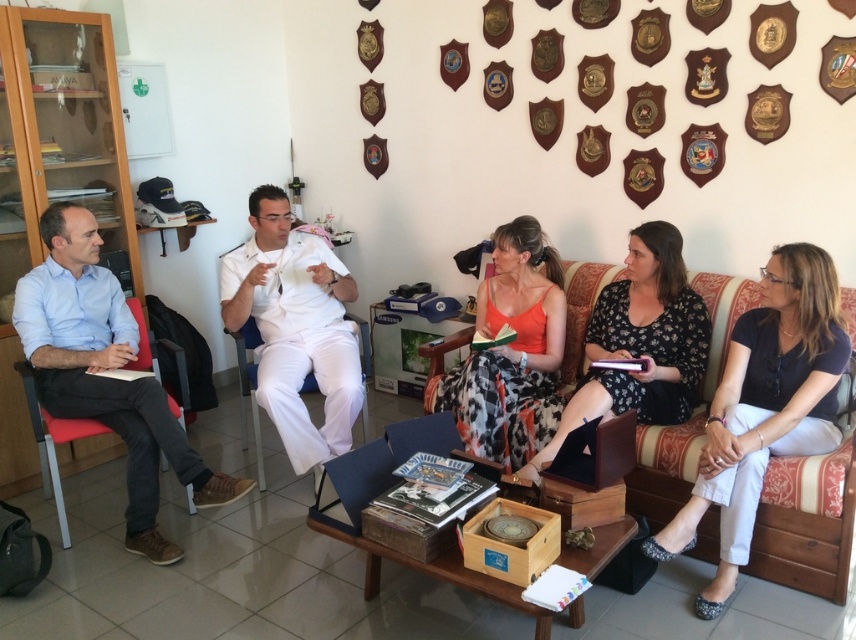
Does white matte uniform at center have a greater height compared to floral fabric dress at center?

Yes, white matte uniform at center is taller than floral fabric dress at center.

Does white matte uniform at center appear on the left side of floral fabric dress at center?

Indeed, white matte uniform at center is positioned on the left side of floral fabric dress at center.

Between point (313, 449) and point (667, 324), which one is positioned in front?

Point (667, 324) is in front.

Identify the location of white matte uniform at center. (295, 326).

Between white cotton pants at lower right and floral fabric dress at center, which one is positioned lower?

Positioned lower is white cotton pants at lower right.

At what (x,y) coordinates should I click in order to perform the action: click on white cotton pants at lower right. Please return your answer as a coordinate pair (x, y). Looking at the image, I should click on (764, 406).

I want to click on white cotton pants at lower right, so click(x=764, y=406).

Between white cotton pants at lower right and wooden couch at lower right, which one is positioned lower?

white cotton pants at lower right

Does white cotton pants at lower right appear on the right side of wooden couch at lower right?

Incorrect, white cotton pants at lower right is not on the right side of wooden couch at lower right.

Who is more forward, (x=812, y=397) or (x=661, y=525)?

Point (x=812, y=397) is in front.

Locate an element on the screen. This screenshot has height=640, width=856. white cotton pants at lower right is located at coordinates (764, 406).